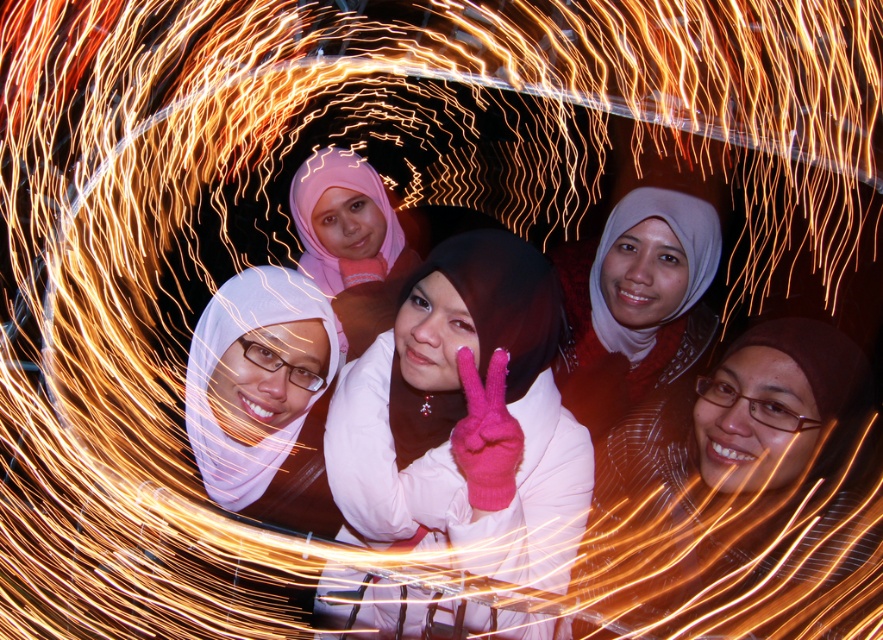
You are a photographer trying to focus on two points in the image. The first point is at coordinate point (530, 497) and the second is at point (578, 310). Which point should you focus on first if you want to start with the one closer to you?

You should focus on point (530, 497) first because it is closer to the viewer than point (578, 310) according to the description.

Consider the image. You are a photographer trying to capture the pink fabric hijab at center in your frame. Given that the point representing it is at coordinates point (738, 492), where should you focus your camera to ensure it is in the center of the image?

The pink fabric hijab at center is represented by point (738, 492), so you should focus your camera at those coordinates to ensure it is centered in the image.

Based on the photo, you are a photographer trying to focus on the pink fabric hijab at center. However, the pink woolen gloves at center are in the way. Can you adjust your camera to focus on the hijab without moving the gloves?

The pink woolen gloves at center are closer to the viewer than the pink fabric hijab at center. To focus on the hijab, you need to adjust the camera focus to a farther distance so it captures the hijab instead of the closer gloves.